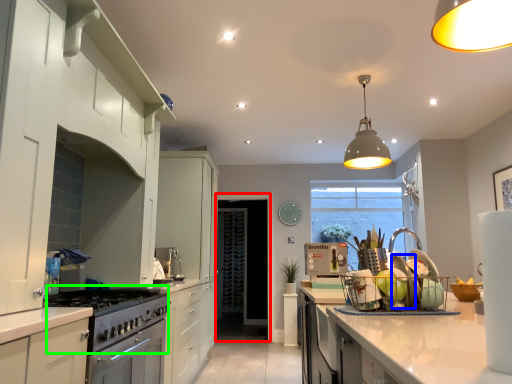
Question: Which object is positioned closest to glass door (highlighted by a red box)? Select from appliance (highlighted by a blue box) and gas stove (highlighted by a green box).

Choices:
 (A) appliance
 (B) gas stove

Answer: (B)